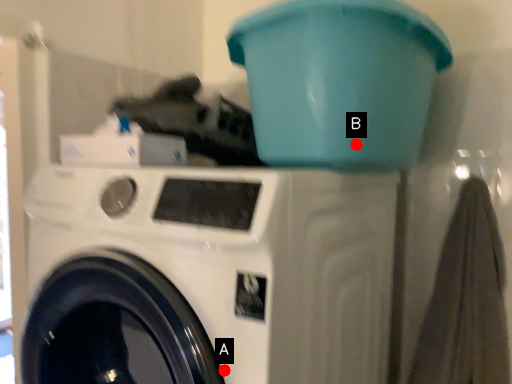
Question: Two points are circled on the image, labeled by A and B beside each circle. Which point appears closest to the camera in this image?

Choices:
 (A) A is closer
 (B) B is closer

Answer: (A)